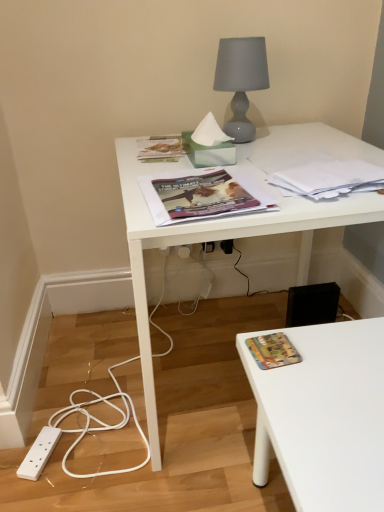
Question: Is white glossy desk at upper center further to the viewer compared to multicolored fabric book at lower right, which appears as the 1th book cover when ordered from the bottom?

Choices:
 (A) no
 (B) yes

Answer: (A)

Question: Is white glossy desk at upper center positioned beyond the bounds of multicolored fabric book at lower right, which appears as the 1th book cover when ordered from the bottom?

Choices:
 (A) yes
 (B) no

Answer: (A)

Question: Is white glossy desk at upper center surrounding multicolored fabric book at lower right, the second book cover from the top?

Choices:
 (A) no
 (B) yes

Answer: (A)

Question: Considering the relative positions of white glossy desk at upper center and multicolored fabric book at lower right, which appears as the 1th book cover when ordered from the bottom, in the image provided, is white glossy desk at upper center to the right of multicolored fabric book at lower right, which appears as the 1th book cover when ordered from the bottom, from the viewer's perspective?

Choices:
 (A) yes
 (B) no

Answer: (A)

Question: Is white glossy desk at upper center in front of multicolored fabric book at lower right, which appears as the 1th book cover when ordered from the bottom?

Choices:
 (A) yes
 (B) no

Answer: (A)

Question: Relative to white plastic electric outlet at lower center, which is the 2th electric outlet in right-to-left order, is white glossy desk at upper center in front or behind?

Choices:
 (A) behind
 (B) front

Answer: (B)

Question: Is white glossy desk at upper center situated inside white plastic electric outlet at lower center, which is the first electric outlet in left-to-right order, or outside?

Choices:
 (A) outside
 (B) inside

Answer: (A)

Question: Is white glossy desk at upper center taller or shorter than white plastic electric outlet at lower center, which is the 2th electric outlet in right-to-left order?

Choices:
 (A) short
 (B) tall

Answer: (B)

Question: Is white glossy desk at upper center wider or thinner than white plastic electric outlet at lower center, which is the 2th electric outlet in right-to-left order?

Choices:
 (A) thin
 (B) wide

Answer: (B)

Question: Is matte gray glass lamp at upper center situated inside white paper at upper right, which is the 1th paperback book from right to left, or outside?

Choices:
 (A) inside
 (B) outside

Answer: (B)

Question: In terms of size, does matte gray glass lamp at upper center appear bigger or smaller than white paper at upper right, which is counted as the first paperback book, starting from the front?

Choices:
 (A) big
 (B) small

Answer: (A)

Question: Is point (230, 47) closer or farther from the camera than point (327, 181)?

Choices:
 (A) closer
 (B) farther

Answer: (B)

Question: Is matte gray glass lamp at upper center wider or thinner than white paper at upper right, the 2th paperback book viewed from the left?

Choices:
 (A) thin
 (B) wide

Answer: (A)

Question: Is point [36, 461] closer or farther from the camera than point [182, 247]?

Choices:
 (A) closer
 (B) farther

Answer: (A)

Question: Would you say white plastic power plugs and sockets at lower left is to the left or to the right of white plastic electric outlet at lower center, which is the 2th electric outlet in right-to-left order, in the picture?

Choices:
 (A) left
 (B) right

Answer: (A)